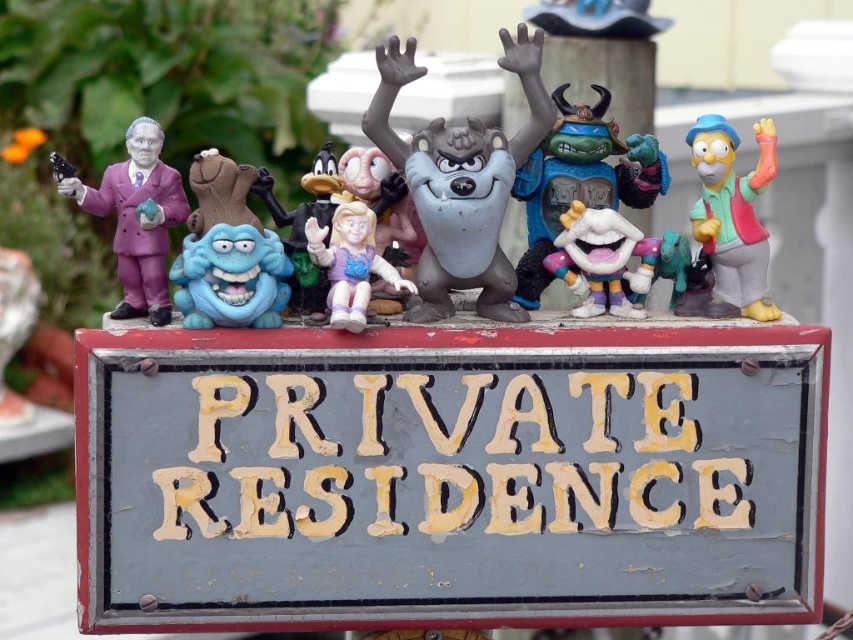
Is blue rubber monster at center closer to the viewer compared to white matte clown at center?

Yes, blue rubber monster at center is closer to the viewer.

Where is `blue rubber monster at center`? This screenshot has height=640, width=853. blue rubber monster at center is located at coordinates (231, 276).

Who is shorter, matte gray wolf at center or matte purple suit at left?

With less height is matte purple suit at left.

Can you confirm if matte gray wolf at center is positioned to the left of matte purple suit at left?

Incorrect, matte gray wolf at center is not on the left side of matte purple suit at left.

This screenshot has width=853, height=640. Find the location of `matte gray wolf at center`. matte gray wolf at center is located at coordinates (461, 180).

Who is positioned more to the left, matte gray wolf at center or blue rubber monster at center?

blue rubber monster at center is more to the left.

Where is `matte gray wolf at center`? This screenshot has height=640, width=853. matte gray wolf at center is located at coordinates (461, 180).